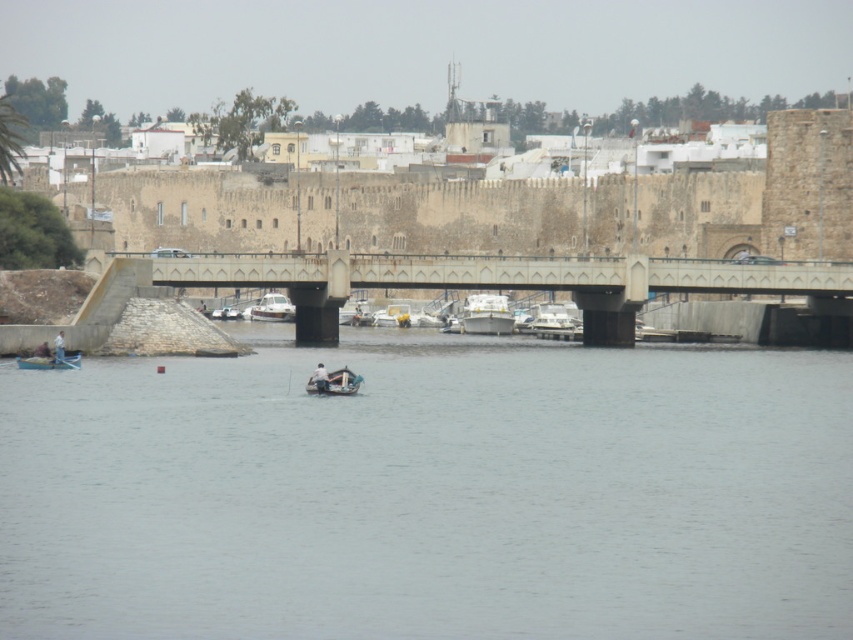
Question: Which is farther from the gray smooth water at center?

Choices:
 (A) wooden boat at lower left
 (B) light blue fabric boat at lower left
 (C) wooden boat at center
 (D) concrete bridge at center

Answer: (A)

Question: Is gray smooth water at center smaller than wooden boat at center?

Choices:
 (A) no
 (B) yes

Answer: (A)

Question: Based on their relative distances, which object is nearer to the concrete bridge at center?

Choices:
 (A) gray smooth water at center
 (B) white fabric boat at center

Answer: (A)

Question: Can you confirm if white glossy boat at center is smaller than light blue fabric boat at lower left?

Choices:
 (A) no
 (B) yes

Answer: (A)

Question: Which point appears closest to the camera in this image?

Choices:
 (A) (257, 310)
 (B) (47, 577)
 (C) (592, 282)

Answer: (B)

Question: Is white matte boat at center below wooden boat at lower left?

Choices:
 (A) no
 (B) yes

Answer: (A)